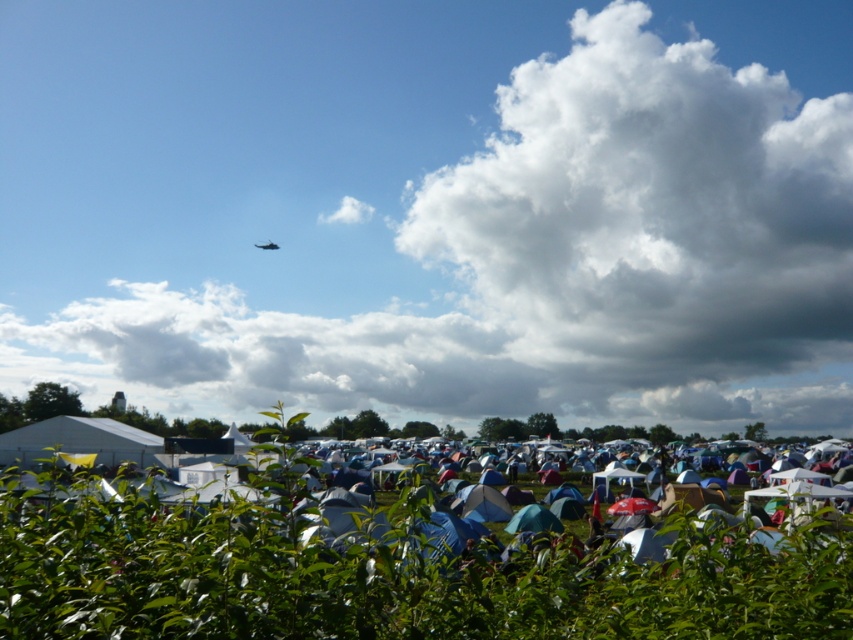
In the scene shown: You are standing at the edge of the festival grounds and want to walk towards the tents. If you see two points marked in the image, one at coordinates point (466, 499) and another at point (254, 243), which point would you reach first as you move forward?

You would reach point (466, 499) first because it is closer to you than point (254, 243).

You are an observer looking at the scene. You notice the white fluffy cloud at upper center and the metallic silver airplane at upper center. Which object appears closer to you?

The white fluffy cloud at upper center appears closer to you because it is positioned further to the viewer than the metallic silver airplane at upper center.

You are a photographer trying to capture a clear shot of the metallic silver airplane at upper center. However, there is a blue fabric tent at center blocking your view. Based on the scene, can you determine if the tent is closer to you or farther away than the airplane?

The blue fabric tent at center is in front of the metallic silver airplane at upper center, so the tent is closer to you and blocking the view of the airplane.